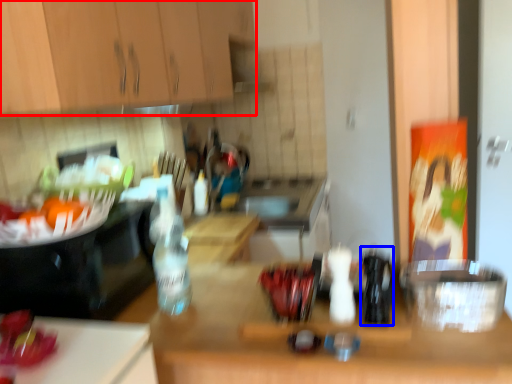
Question: Which object is closer to the camera taking this photo, cabinetry (highlighted by a red box) or bottle (highlighted by a blue box)?

Choices:
 (A) cabinetry
 (B) bottle

Answer: (A)